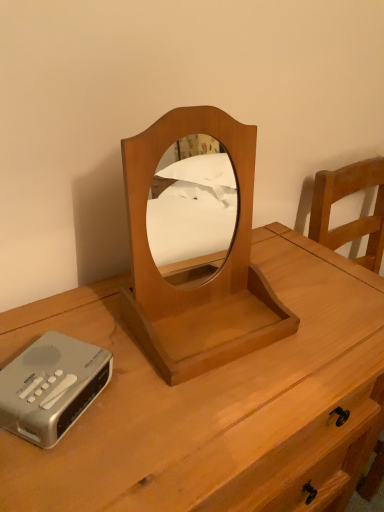
Locate an element on the screen. free space to the back side of silver metallic cassette at lower left is located at coordinates (84, 320).